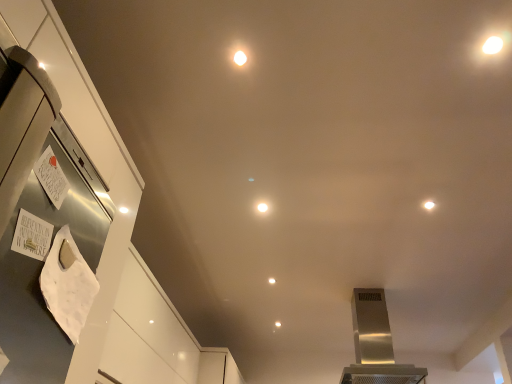
Question: Is white glossy light at upper center, acting as the first light starting from the top, turned away from matte white light at center, the 3th light from the left?

Choices:
 (A) no
 (B) yes

Answer: (A)

Question: Could you tell me if white glossy light at upper center, the third light positioned from the bottom, is facing matte white light at center, which is counted as the first light, starting from the bottom?

Choices:
 (A) no
 (B) yes

Answer: (A)

Question: Considering the relative sizes of white glossy light at upper center, arranged as the 3th light when viewed from the back, and matte white light at center, marked as the 3th light in a top-to-bottom arrangement, in the image provided, is white glossy light at upper center, arranged as the 3th light when viewed from the back, thinner than matte white light at center, marked as the 3th light in a top-to-bottom arrangement,?

Choices:
 (A) no
 (B) yes

Answer: (B)

Question: Is white glossy light at upper center, which appears as the 1th light when viewed from the left, touching matte white light at center, marked as the 3th light in a top-to-bottom arrangement?

Choices:
 (A) yes
 (B) no

Answer: (B)

Question: From a real-world perspective, is white glossy light at upper center, acting as the first light starting from the top, on matte white light at center, the 1th light positioned from the back?

Choices:
 (A) no
 (B) yes

Answer: (B)

Question: Does white glossy light at upper center, arranged as the 1th light when viewed from the front, have a larger size compared to matte white light at center, the 1th light positioned from the back?

Choices:
 (A) yes
 (B) no

Answer: (A)

Question: Does white glossy light at center, which is counted as the second light, starting from the bottom, have a greater height compared to matte white light at center, which is counted as the first light, starting from the bottom?

Choices:
 (A) no
 (B) yes

Answer: (A)

Question: From the image's perspective, is white glossy light at center, which is the 2th light from left to right, located beneath matte white light at center, arranged as the 1th light when viewed from the right?

Choices:
 (A) no
 (B) yes

Answer: (A)

Question: Considering the relative sizes of white glossy light at center, which is counted as the second light, starting from the bottom, and matte white light at center, which appears as the third light when viewed from the front, in the image provided, is white glossy light at center, which is counted as the second light, starting from the bottom, bigger than matte white light at center, which appears as the third light when viewed from the front,?

Choices:
 (A) yes
 (B) no

Answer: (B)

Question: From a real-world perspective, is white glossy light at center, the 2th light in the front-to-back sequence, physically above matte white light at center, the 1th light positioned from the back?

Choices:
 (A) no
 (B) yes

Answer: (B)

Question: Can you confirm if white glossy light at center, positioned as the second light in top-to-bottom order, is smaller than matte white light at center, the 1th light positioned from the back?

Choices:
 (A) no
 (B) yes

Answer: (B)

Question: Would you say white glossy light at center, the 2th light in the front-to-back sequence, contains matte white light at center, arranged as the 1th light when viewed from the right?

Choices:
 (A) no
 (B) yes

Answer: (A)

Question: Considering the relative sizes of stainless steel range hood at center and matte white light at center, marked as the 3th light in a top-to-bottom arrangement, in the image provided, is stainless steel range hood at center bigger than matte white light at center, marked as the 3th light in a top-to-bottom arrangement,?

Choices:
 (A) yes
 (B) no

Answer: (A)